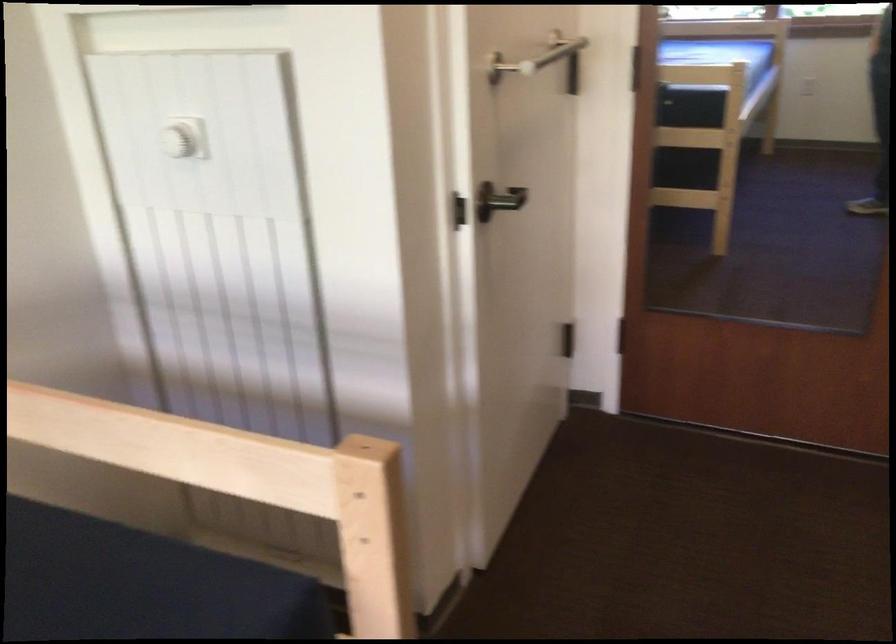
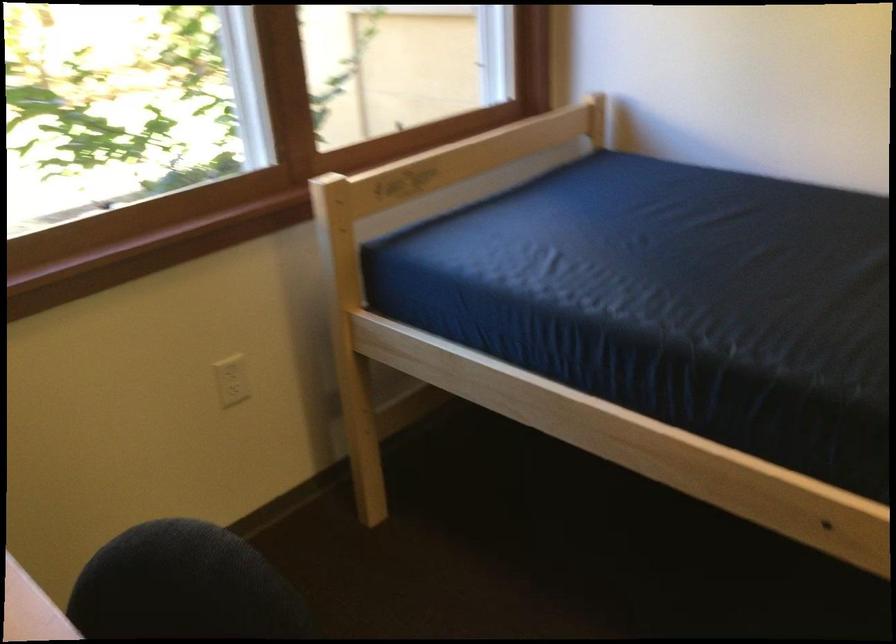
How did the camera likely rotate?

The camera rotated toward left-down.